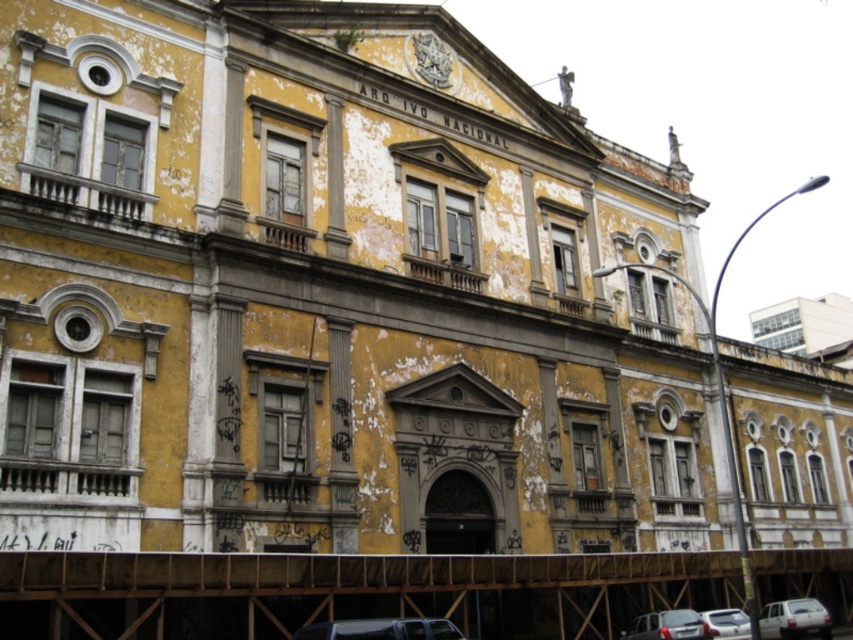
What are the coordinates of the white matte car at lower right?

The white matte car at lower right is located at coordinates point (793, 620).

You are a delivery person who needs to park your van next to the white matte car at lower right and the white glossy car at lower right. Which car should you park behind to ensure enough clearance for your van?

You should park behind the white matte car at lower right because it is much taller than the white glossy car at lower right, providing more vertical space for your van.